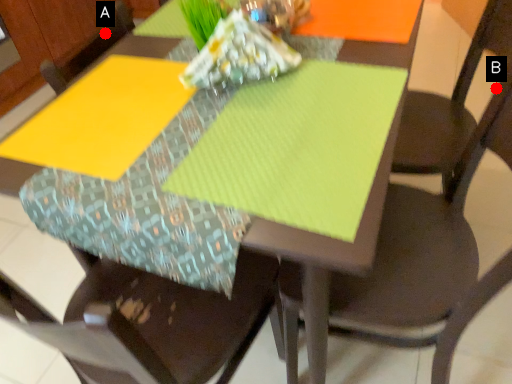
Question: Two points are circled on the image, labeled by A and B beside each circle. Which point is closer to the camera?

Choices:
 (A) A is closer
 (B) B is closer

Answer: (A)